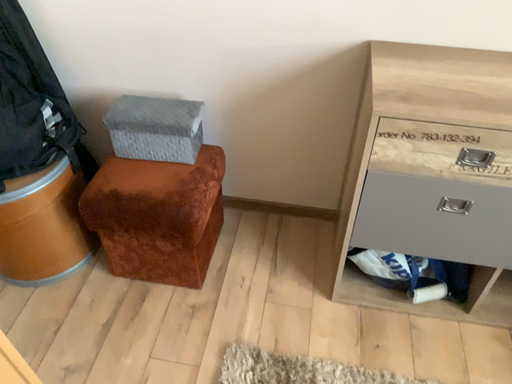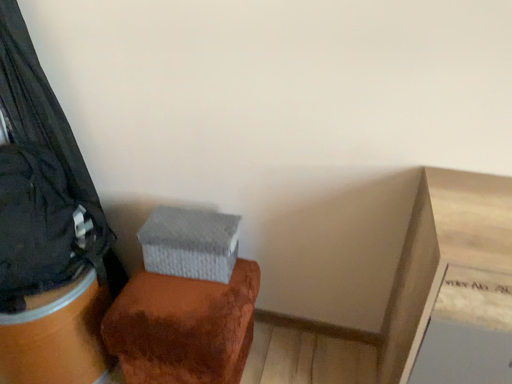
Question: How did the camera likely rotate when shooting the video?

Choices:
 (A) rotated upward
 (B) rotated downward

Answer: (A)